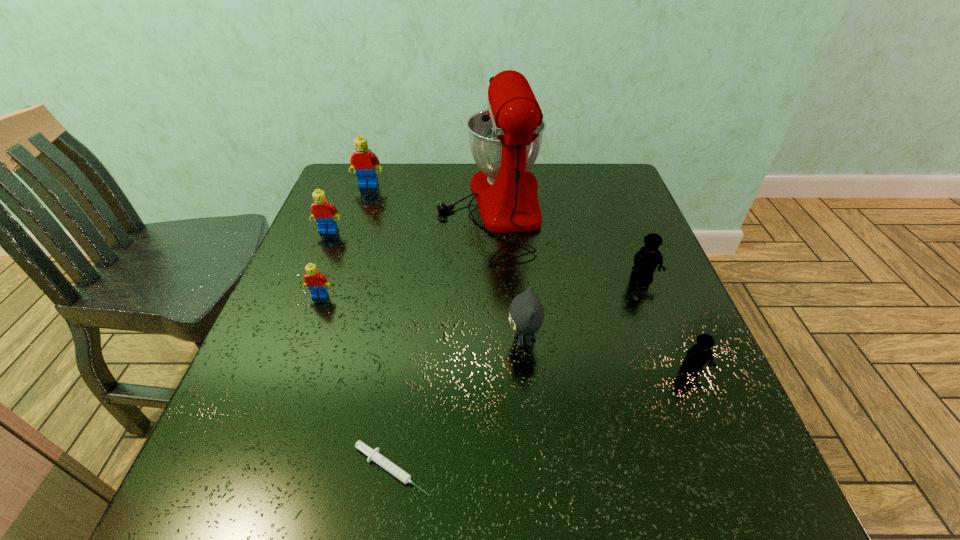
Where is `object that is at the far left corner`? object that is at the far left corner is located at coordinates [363, 161].

The height and width of the screenshot is (540, 960). Identify the location of vacant space at the far edge of the desktop. (465, 166).

This screenshot has width=960, height=540. In order to click on free space at the left edge in this screenshot , I will do `click(252, 375)`.

I want to click on vacant space at the right edge of the desktop, so click(x=660, y=320).

This screenshot has height=540, width=960. In the image, there is a desktop. Find the location of `vacant space at the far left corner`. vacant space at the far left corner is located at coordinates (348, 175).

I want to click on vacant space in between the second farthest Lego and the red mixer, so click(x=410, y=219).

You are a GUI agent. You are given a task and a screenshot of the screen. Output one action in this format:
    pyautogui.click(x=<x>, y=<y>)
    Task: Click on the free space between the kitten and the nearest object
    
    Given the screenshot: What is the action you would take?
    pyautogui.click(x=458, y=404)

You are a GUI agent. You are given a task and a screenshot of the screen. Output one action in this format:
    pyautogui.click(x=<x>, y=<y>)
    Task: Click on the free spot between the second nearest red Lego and the farther yellow Lego
    This screenshot has height=540, width=960.
    Given the screenshot: What is the action you would take?
    pyautogui.click(x=485, y=254)

Locate an element on the screen. unoccupied position between the kitten and the nearest object is located at coordinates (458, 404).

Where is `vacant space that is in between the fourth farthest Lego and the farthest red Lego`? The width and height of the screenshot is (960, 540). vacant space that is in between the fourth farthest Lego and the farthest red Lego is located at coordinates (345, 240).